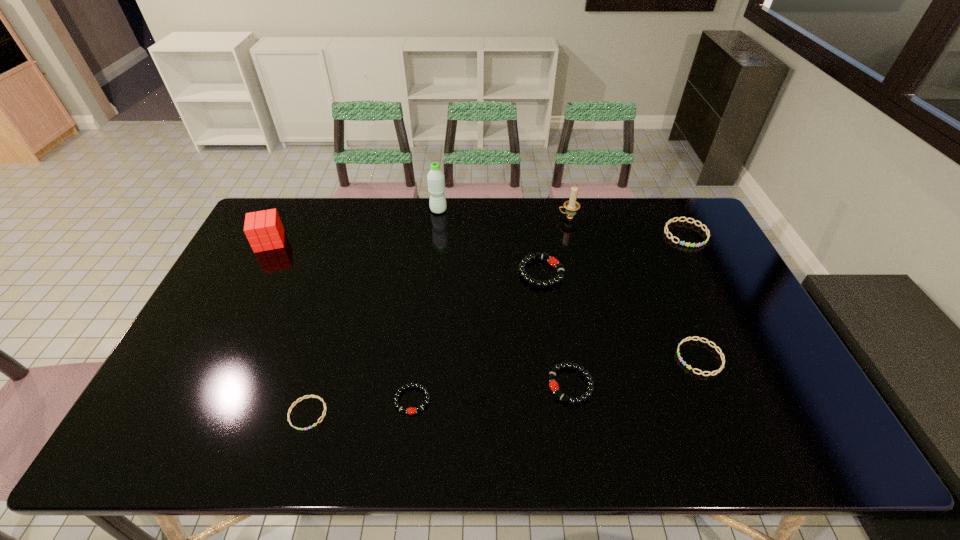
Where is `bracelet located at the far edge`? Image resolution: width=960 pixels, height=540 pixels. bracelet located at the far edge is located at coordinates (672, 237).

Where is `object that is at the near edge`? Image resolution: width=960 pixels, height=540 pixels. object that is at the near edge is located at coordinates (309, 396).

This screenshot has width=960, height=540. I want to click on object that is at the left edge, so click(264, 230).

This screenshot has height=540, width=960. Identify the location of object present at the far left corner. (264, 230).

Image resolution: width=960 pixels, height=540 pixels. Find the location of `object at the far right corner`. object at the far right corner is located at coordinates (672, 237).

Identify the location of vacant space at the far edge of the desktop. (545, 228).

The width and height of the screenshot is (960, 540). What are the coordinates of `vacant area at the near edge` in the screenshot? It's located at (399, 434).

What are the coordinates of `free location at the left edge of the desktop` in the screenshot? It's located at (243, 341).

In the image, there is a desktop. At what (x,y) coordinates should I click in order to perform the action: click on vacant region at the right edge. Please return your answer as a coordinate pair (x, y). Looking at the image, I should click on point(770,401).

I want to click on vacant space at the far left corner, so click(x=289, y=210).